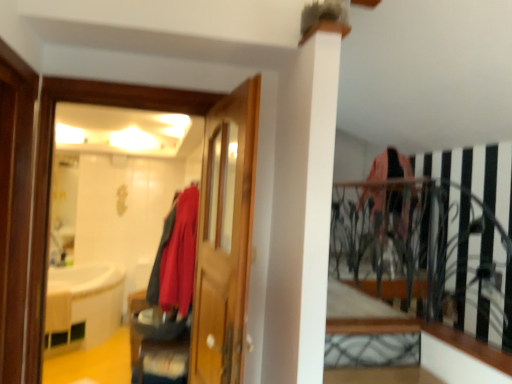
Question: From the image's perspective, would you say brushed metal shoe at lower center is positioned over wooden door at center?

Choices:
 (A) yes
 (B) no

Answer: (B)

Question: Does brushed metal shoe at lower center have a lesser width compared to wooden door at center?

Choices:
 (A) no
 (B) yes

Answer: (A)

Question: From the image's perspective, is brushed metal shoe at lower center under wooden door at center?

Choices:
 (A) yes
 (B) no

Answer: (A)

Question: Is brushed metal shoe at lower center shorter than wooden door at center?

Choices:
 (A) yes
 (B) no

Answer: (A)

Question: Does brushed metal shoe at lower center come in front of wooden door at center?

Choices:
 (A) no
 (B) yes

Answer: (A)

Question: Based on their positions, is matte wooden mirror at left located to the left or right of brushed metal shoe at lower center?

Choices:
 (A) right
 (B) left

Answer: (A)

Question: Which is correct: matte wooden mirror at left is inside brushed metal shoe at lower center, or outside of it?

Choices:
 (A) outside
 (B) inside

Answer: (A)

Question: Is point (93, 278) closer or farther from the camera than point (183, 382)?

Choices:
 (A) closer
 (B) farther

Answer: (B)

Question: In terms of width, does matte wooden mirror at left look wider or thinner when compared to brushed metal shoe at lower center?

Choices:
 (A) wide
 (B) thin

Answer: (B)

Question: Is white wood ledge at lower right taller or shorter than brushed metal shoe at lower center?

Choices:
 (A) tall
 (B) short

Answer: (B)

Question: Visually, is white wood ledge at lower right positioned to the left or to the right of brushed metal shoe at lower center?

Choices:
 (A) right
 (B) left

Answer: (A)

Question: Considering their positions, is white wood ledge at lower right located in front of or behind brushed metal shoe at lower center?

Choices:
 (A) behind
 (B) front

Answer: (B)

Question: From a real-world perspective, is white wood ledge at lower right positioned above or below brushed metal shoe at lower center?

Choices:
 (A) below
 (B) above

Answer: (B)

Question: Is matte wooden mirror at left inside or outside of matte red coat at center?

Choices:
 (A) inside
 (B) outside

Answer: (B)

Question: Looking at the image, does matte wooden mirror at left seem bigger or smaller compared to matte red coat at center?

Choices:
 (A) big
 (B) small

Answer: (A)